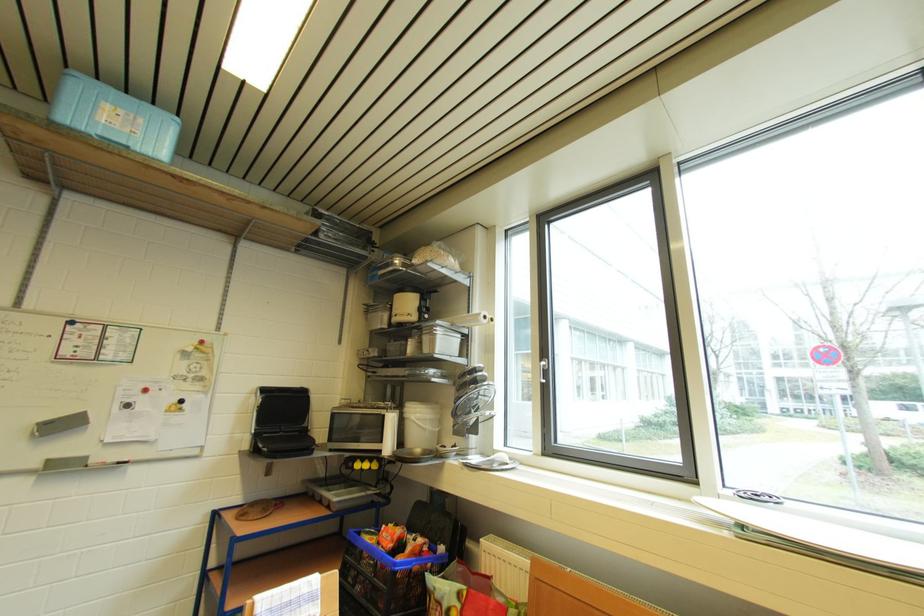
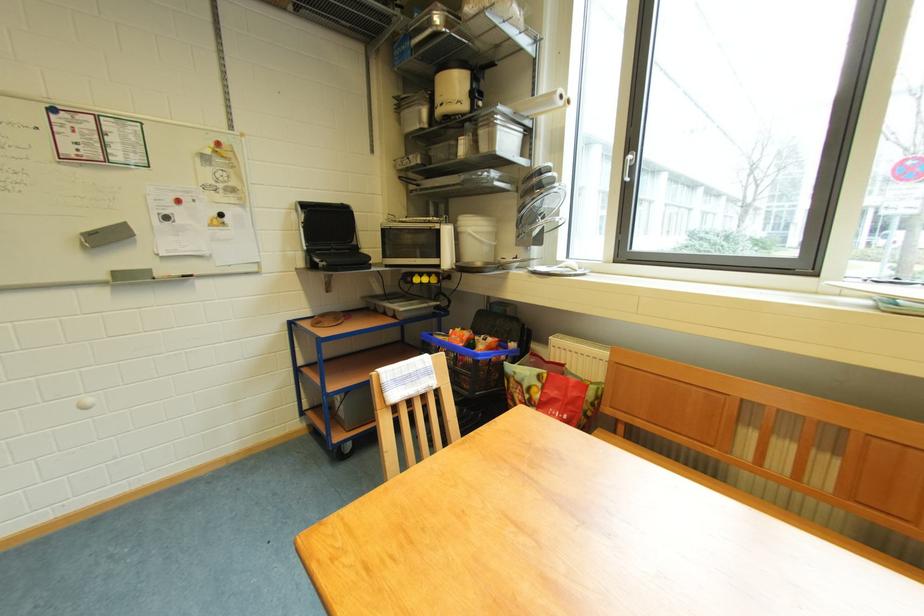
Question: Based on the continuous images, in which direction is the camera rotating? Reply with the corresponding letter.

Choices:
 (A) Left
 (B) Right
 (C) Up
 (D) Down

Answer: (D)